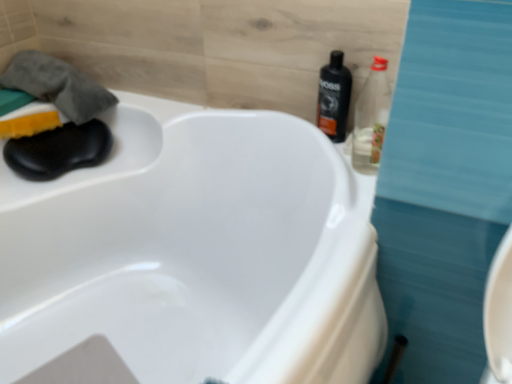
Question: From the image's perspective, is black plastic bottle at upper right, the 1th bottle from the back, below yellow sponge at left?

Choices:
 (A) no
 (B) yes

Answer: (A)

Question: Can you confirm if black plastic bottle at upper right, placed as the 2th bottle when sorted from front to back, is shorter than yellow sponge at left?

Choices:
 (A) no
 (B) yes

Answer: (A)

Question: Considering the relative sizes of black plastic bottle at upper right, the 1th bottle from the back, and yellow sponge at left in the image provided, is black plastic bottle at upper right, the 1th bottle from the back, smaller than yellow sponge at left?

Choices:
 (A) yes
 (B) no

Answer: (B)

Question: Is black plastic bottle at upper right, the 1th bottle from the back, far away from yellow sponge at left?

Choices:
 (A) no
 (B) yes

Answer: (A)

Question: Is black plastic bottle at upper right, placed as the 2th bottle when sorted from front to back, at the left side of yellow sponge at left?

Choices:
 (A) yes
 (B) no

Answer: (B)

Question: In terms of width, does gray cotton towel at upper left look wider or thinner when compared to yellow sponge at left?

Choices:
 (A) thin
 (B) wide

Answer: (B)

Question: Visually, is gray cotton towel at upper left positioned to the left or to the right of yellow sponge at left?

Choices:
 (A) left
 (B) right

Answer: (B)

Question: From the image's perspective, is gray cotton towel at upper left located above or below yellow sponge at left?

Choices:
 (A) below
 (B) above

Answer: (B)

Question: Is gray cotton towel at upper left in front of or behind yellow sponge at left in the image?

Choices:
 (A) front
 (B) behind

Answer: (B)

Question: Would you say clear plastic bottle at upper right, positioned as the 1th bottle in front-to-back order, is to the left or to the right of black plastic bottle at upper right, the 1th bottle from the back, in the picture?

Choices:
 (A) right
 (B) left

Answer: (A)

Question: Is clear plastic bottle at upper right, positioned as the 1th bottle in front-to-back order, in front of or behind black plastic bottle at upper right, placed as the 2th bottle when sorted from front to back, in the image?

Choices:
 (A) front
 (B) behind

Answer: (A)

Question: Considering the positions of clear plastic bottle at upper right, placed as the second bottle when sorted from back to front, and black plastic bottle at upper right, the 1th bottle from the back, in the image, is clear plastic bottle at upper right, placed as the second bottle when sorted from back to front, wider or thinner than black plastic bottle at upper right, the 1th bottle from the back,?

Choices:
 (A) wide
 (B) thin

Answer: (B)

Question: From the image's perspective, relative to black plastic bottle at upper right, placed as the 2th bottle when sorted from front to back, is clear plastic bottle at upper right, placed as the second bottle when sorted from back to front, above or below?

Choices:
 (A) below
 (B) above

Answer: (A)

Question: Is point (57, 71) positioned closer to the camera than point (373, 104)?

Choices:
 (A) farther
 (B) closer

Answer: (A)

Question: Which is correct: gray cotton towel at upper left is inside clear plastic bottle at upper right, placed as the second bottle when sorted from back to front, or outside of it?

Choices:
 (A) inside
 (B) outside

Answer: (B)